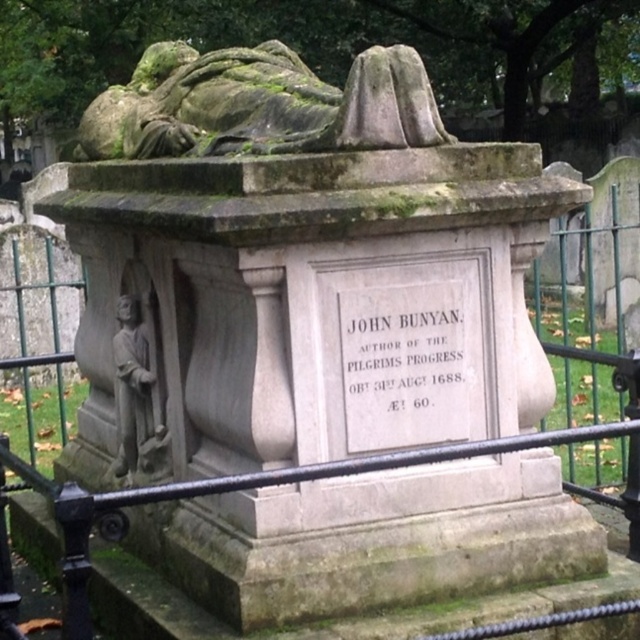
Which is in front, point (348, 529) or point (129, 362)?

Point (348, 529) is more forward.

Does black metal fence at center have a greater width compared to stone statue at left?

Yes.

What do you see at coordinates (310, 308) in the screenshot? I see `black metal fence at center` at bounding box center [310, 308].

Find the location of a particular element. black metal fence at center is located at coordinates (310, 308).

Looking at this image, does green mossy stone sculpture at upper center have a lesser width compared to stone statue at left?

In fact, green mossy stone sculpture at upper center might be wider than stone statue at left.

Which is more to the right, green mossy stone sculpture at upper center or stone statue at left?

green mossy stone sculpture at upper center is more to the right.

Which is behind, point (406, 129) or point (125, 468)?

Point (125, 468)

Find the location of a particular element. This screenshot has height=640, width=640. green mossy stone sculpture at upper center is located at coordinates (259, 104).

Measure the distance between black metal fence at center and green mossy stone sculpture at upper center.

27.56 inches

The height and width of the screenshot is (640, 640). I want to click on black metal fence at center, so click(x=310, y=308).